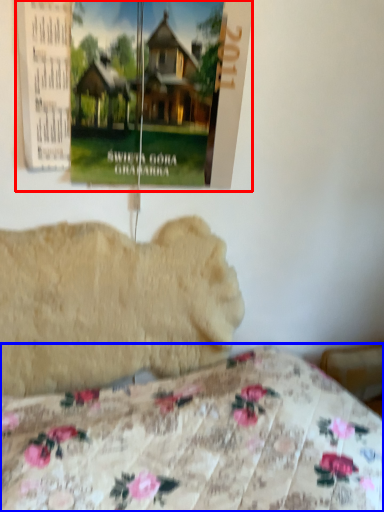
Question: Which object appears closest to the camera in this image, poster page (highlighted by a red box) or bed (highlighted by a blue box)?

Choices:
 (A) poster page
 (B) bed

Answer: (B)